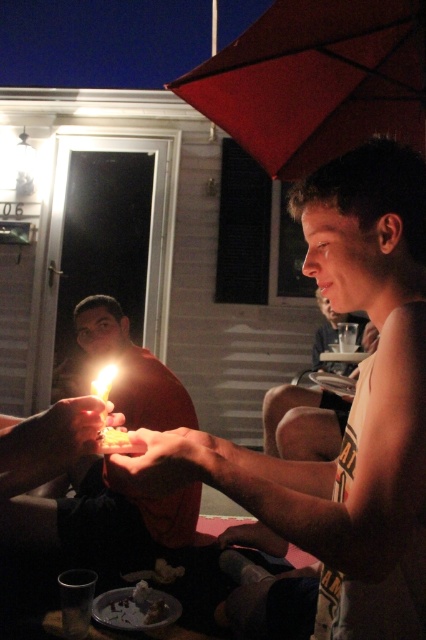
You are at a nighttime gathering on a porch and want to take a photo of the smooth skin face at center and the matte red umbrella at upper center. Which object should you place on the left side of your photo frame?

The matte red umbrella at upper center should be placed on the left side of your photo frame because it is located to the left of the smooth skin face at center.

You are at a nighttime gathering on a porch and want to take a photo of the matte red umbrella at upper center and the smooth skin face at center. Which object is shorter in the photo?

The matte red umbrella at upper center is shorter than the smooth skin face at center in the photo.